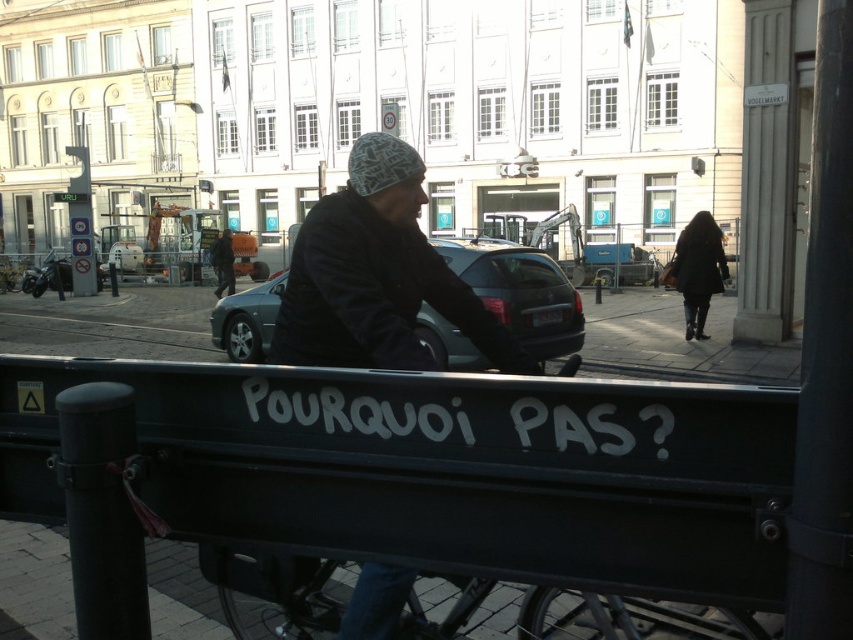
Is point (281, 355) positioned behind point (701, 316)?

No.

Does point (389, 276) come behind point (704, 280)?

That is False.

Image resolution: width=853 pixels, height=640 pixels. Find the location of `black woolen hat at center`. black woolen hat at center is located at coordinates (376, 275).

Who is taller, black woolen hat at center or shiny black car at center?

shiny black car at center

In the scene shown: Is black woolen hat at center wider than shiny black car at center?

In fact, black woolen hat at center might be narrower than shiny black car at center.

Find the location of a particular element. The width and height of the screenshot is (853, 640). black woolen hat at center is located at coordinates (376, 275).

Between shiny black car at center and dark gray knit cap at upper center, which one appears on the left side from the viewer's perspective?

dark gray knit cap at upper center

Is the position of shiny black car at center more distant than that of dark gray knit cap at upper center?

No, shiny black car at center is in front of dark gray knit cap at upper center.

Who is more forward, (575, 349) or (229, 284)?

Positioned in front is point (575, 349).

You are a GUI agent. You are given a task and a screenshot of the screen. Output one action in this format:
    pyautogui.click(x=<x>, y=<y>)
    Task: Click on the shiny black car at center
    
    Given the screenshot: What is the action you would take?
    pyautogui.click(x=520, y=292)